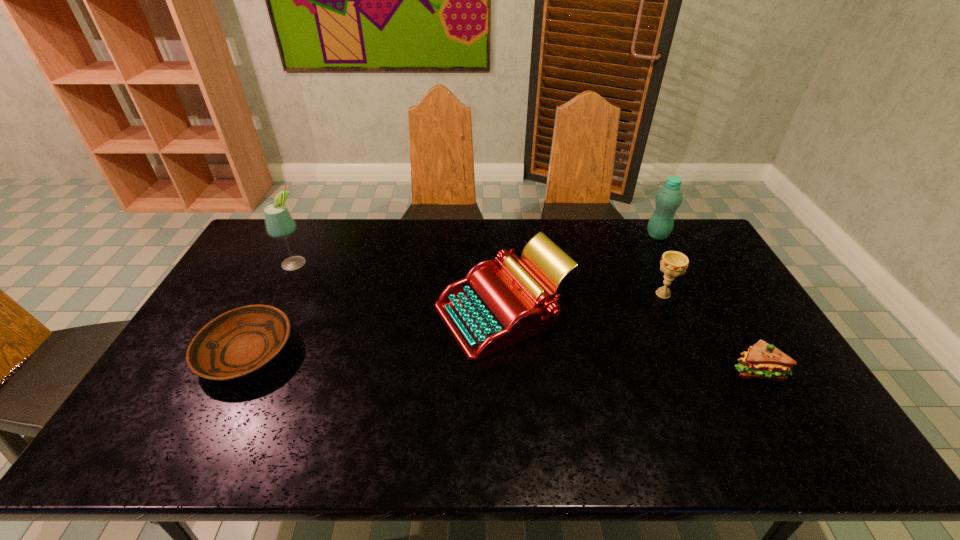
Image resolution: width=960 pixels, height=540 pixels. I want to click on vacant space at the right edge, so click(x=683, y=275).

Identify the location of vacant space at the near left corner of the desktop. pyautogui.click(x=132, y=448).

Where is `unoccupied area between the third object from left to right and the sandwich`? This screenshot has width=960, height=540. unoccupied area between the third object from left to right and the sandwich is located at coordinates (629, 342).

Identify the location of unoccupied area between the third object from left to right and the fifth tallest object. (629, 342).

The height and width of the screenshot is (540, 960). I want to click on unoccupied area between the plate and the third tallest object, so click(374, 333).

At what (x,y) coordinates should I click in order to perform the action: click on free point between the chalice and the typewriter. Please return your answer as a coordinate pair (x, y). Looking at the image, I should click on (583, 304).

Identify the location of blank region between the typewriter and the third shortest object. (583, 304).

Find the location of `the second closest object relative to the plate`. the second closest object relative to the plate is located at coordinates (492, 308).

Identify which object is the third closest to the fourth tallest object. Please provide its 2D coordinates. Your answer should be formatted as a tuple, i.e. [(x, y)], where the tuple contains the x and y coordinates of a point satisfying the conditions above.

[(492, 308)]

Identify the location of free space that satisfies the following two spatial constraints: 1. at the front cap of the water bottle; 2. on the right side of the fifth tallest object. (728, 370).